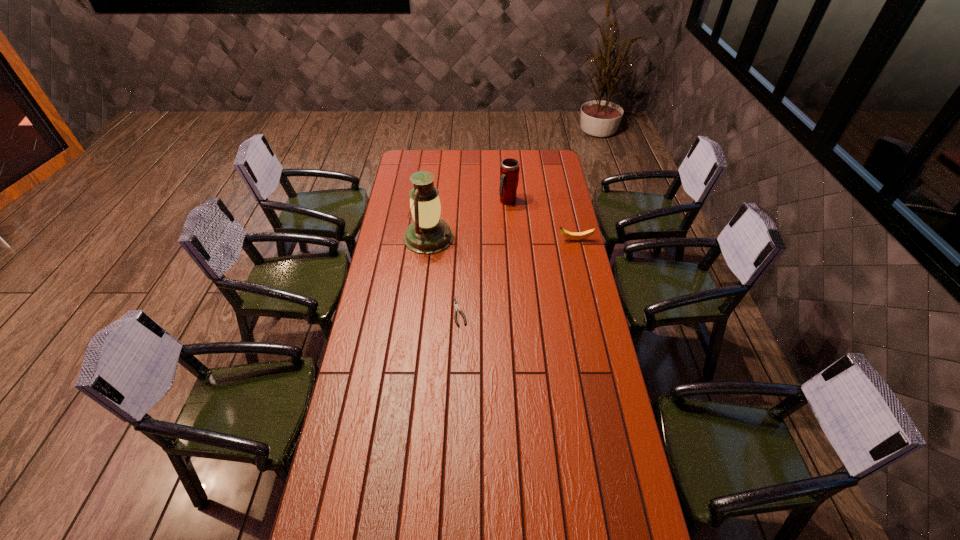
Find the location of a particular element. The height and width of the screenshot is (540, 960). free spot located at the stem of the second shortest object is located at coordinates (547, 240).

The width and height of the screenshot is (960, 540). In order to click on free space located at the stem of the second shortest object in this screenshot , I will do `click(513, 240)`.

The height and width of the screenshot is (540, 960). Find the location of `vacant area situated 0.330m on the side with the handle of the farthest object`. vacant area situated 0.330m on the side with the handle of the farthest object is located at coordinates click(x=520, y=252).

Find the location of a particular element. The image size is (960, 540). free space located on the side with the handle of the farthest object is located at coordinates (520, 252).

Where is `free space located 0.160m on the side with the handle of the farthest object`? This screenshot has height=540, width=960. free space located 0.160m on the side with the handle of the farthest object is located at coordinates click(x=515, y=228).

The height and width of the screenshot is (540, 960). Identify the location of vacant space positioned 0.360m with the light compartment facing forward on the lantern. (526, 261).

Locate an element on the screen. This screenshot has height=540, width=960. free space located with the light compartment facing forward on the lantern is located at coordinates (476, 249).

I want to click on vacant space positioned 0.080m with the light compartment facing forward on the lantern, so click(468, 247).

The width and height of the screenshot is (960, 540). Find the location of `object that is at the left edge`. object that is at the left edge is located at coordinates (427, 234).

I want to click on object positioned at the right edge, so click(586, 234).